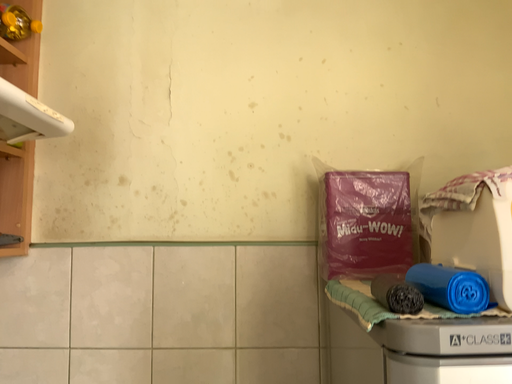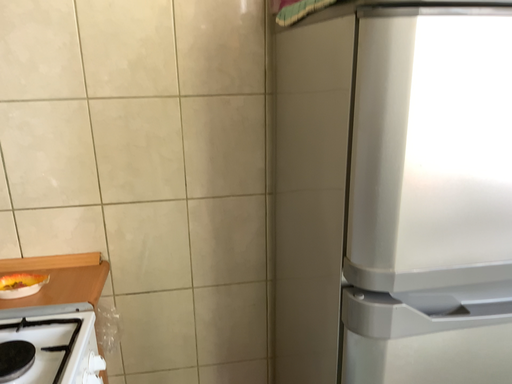
Question: How did the camera likely rotate when shooting the video?

Choices:
 (A) rotated upward
 (B) rotated downward

Answer: (B)